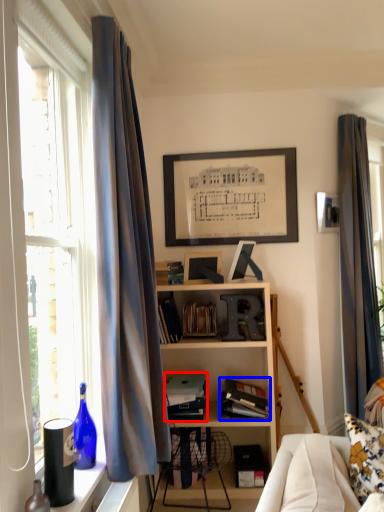
Question: Which object is further to the camera taking this photo, book (highlighted by a red box) or book (highlighted by a blue box)?

Choices:
 (A) book
 (B) book

Answer: (A)